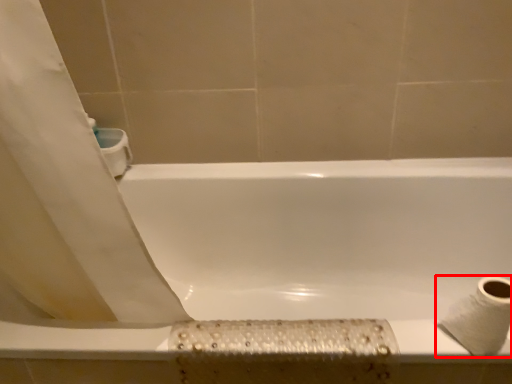
Question: Considering the relative positions of toilet paper (annotated by the red box) and bathtub in the image provided, where is toilet paper (annotated by the red box) located with respect to the staircase?

Choices:
 (A) left
 (B) right

Answer: (B)